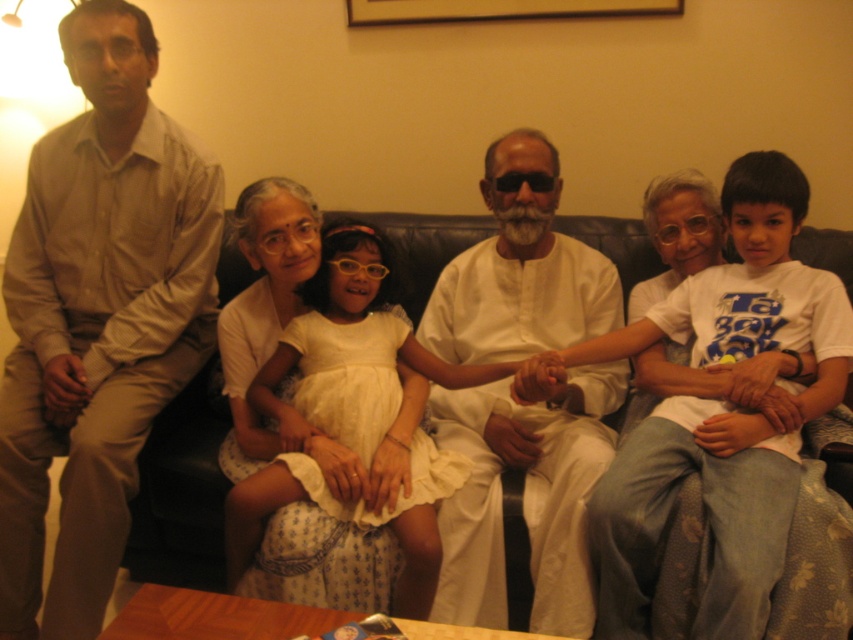
Question: Can you confirm if white cotton dress at center is bigger than wooden picture frame at upper center?

Choices:
 (A) no
 (B) yes

Answer: (B)

Question: Which point is closer to the camera taking this photo?

Choices:
 (A) (665, 564)
 (B) (102, 595)
 (C) (498, 163)

Answer: (A)

Question: Is matte beige shirt at left thinner than white cotton dress at center?

Choices:
 (A) yes
 (B) no

Answer: (A)

Question: Estimate the real-world distances between objects in this image. Which object is closer to the black leather couch at center?

Choices:
 (A) wooden picture frame at upper center
 (B) white cotton kurta at center
 (C) matte beige shirt at left

Answer: (C)

Question: Is white cotton shirt at center in front of white cotton kurta at center?

Choices:
 (A) yes
 (B) no

Answer: (A)

Question: Among these objects, which one is farthest from the camera?

Choices:
 (A) wooden picture frame at upper center
 (B) matte beige shirt at left
 (C) white cotton kurta at center
 (D) white cotton shirt at center

Answer: (A)